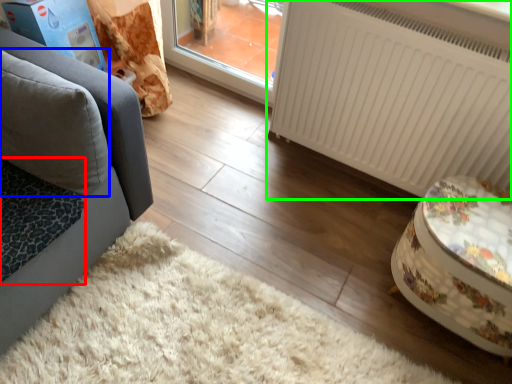
Question: Considering the real-world distances, which object is farthest from cat bed (highlighted by a red box)? pillow (highlighted by a blue box) or radiator (highlighted by a green box)?

Choices:
 (A) pillow
 (B) radiator

Answer: (B)